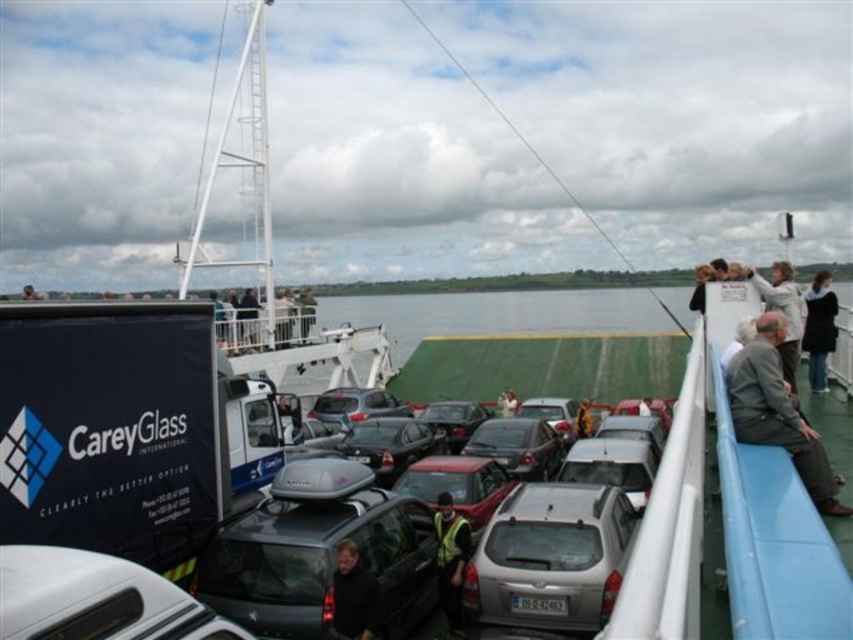
Which is above, yellow reflective vest at center or white fabric jacket at upper right?

white fabric jacket at upper right

Between yellow reflective vest at center and white fabric jacket at upper right, which one appears on the right side from the viewer's perspective?

white fabric jacket at upper right is more to the right.

Is point (451, 518) positioned before point (781, 294)?

That is False.

Locate an element on the screen. yellow reflective vest at center is located at coordinates (451, 557).

Which of these two, satin silver car at center or yellow fabric jacket at center, stands shorter?

Standing shorter between the two is yellow fabric jacket at center.

Based on the photo, who is more distant from viewer, [566,532] or [579,410]?

The point [579,410] is behind.

Who is more forward, (582,509) or (579,436)?

Point (582,509) is in front.

Locate an element on the screen. Image resolution: width=853 pixels, height=640 pixels. satin silver car at center is located at coordinates [550, 557].

Does metallic silver car at center appear on the left side of yellow fabric jacket at center?

Indeed, metallic silver car at center is positioned on the left side of yellow fabric jacket at center.

Which is in front, point (531, 442) or point (581, 404)?

Point (531, 442) is in front.

What do you see at coordinates (518, 445) in the screenshot? I see `metallic silver car at center` at bounding box center [518, 445].

At what (x,y) coordinates should I click in order to perform the action: click on metallic silver car at center. Please return your answer as a coordinate pair (x, y). The width and height of the screenshot is (853, 640). Looking at the image, I should click on (518, 445).